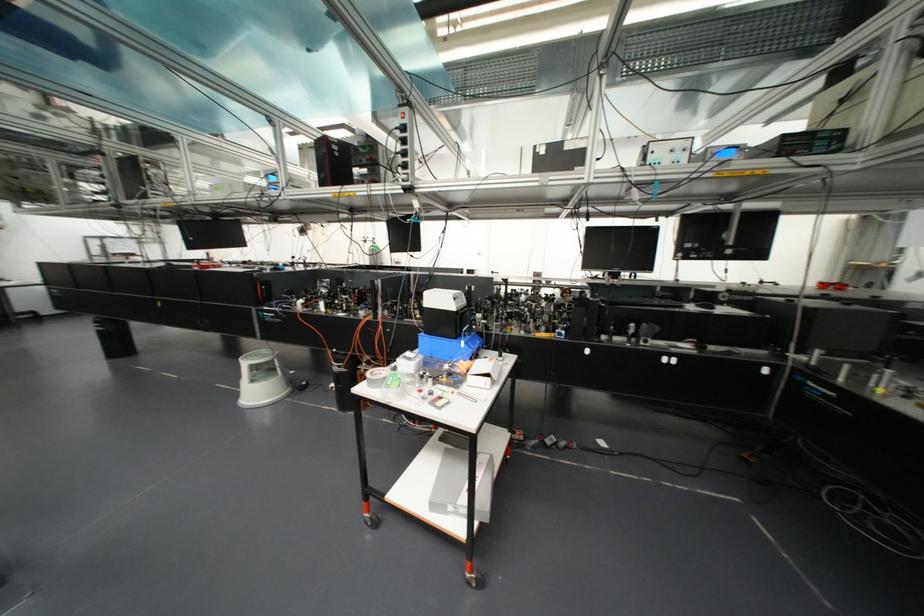
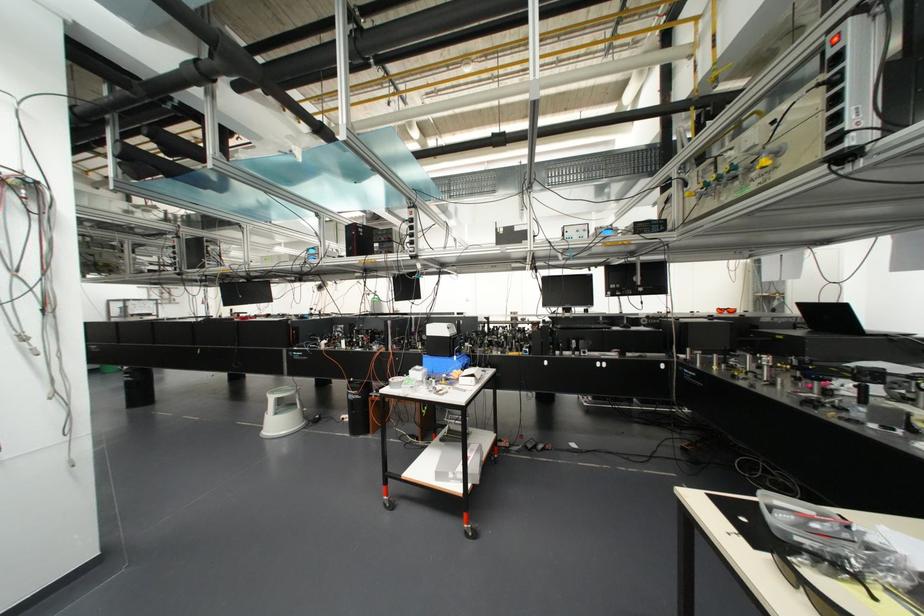
Question: The first image is from the beginning of the video and the second image is from the end. How did the camera likely rotate when shooting the video?

Choices:
 (A) Left
 (B) Right
 (C) Up
 (D) Down

Answer: (C)